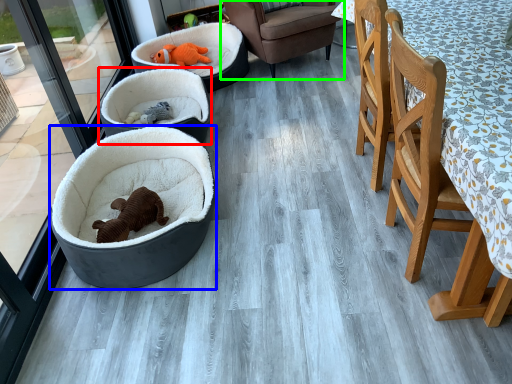
Question: Which is nearer to the dog bed (highlighted by a red box)? dog bed (highlighted by a blue box) or chair (highlighted by a green box).

Choices:
 (A) dog bed
 (B) chair

Answer: (A)